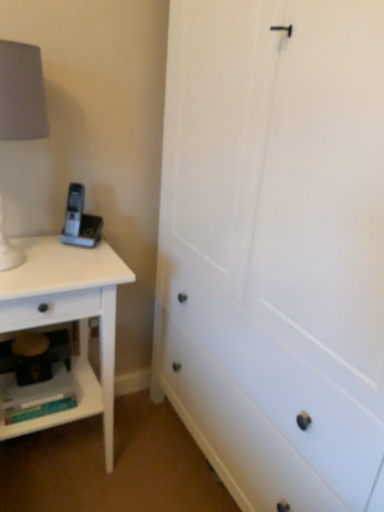
Question: Do you think white matte nightstand at left is within white matte lampshade at left, or outside of it?

Choices:
 (A) outside
 (B) inside

Answer: (A)

Question: Is white matte nightstand at left bigger or smaller than white matte lampshade at left?

Choices:
 (A) small
 (B) big

Answer: (B)

Question: Estimate the real-world distances between objects in this image. Which object is farther from the matte plastic shelf at lower left?

Choices:
 (A) white matte lampshade at left
 (B) white matte chest of drawers at center
 (C) white matte nightstand at left

Answer: (A)

Question: Which is nearer to the matte plastic shelf at lower left?

Choices:
 (A) white matte nightstand at left
 (B) white matte lampshade at left
 (C) white matte chest of drawers at center

Answer: (A)